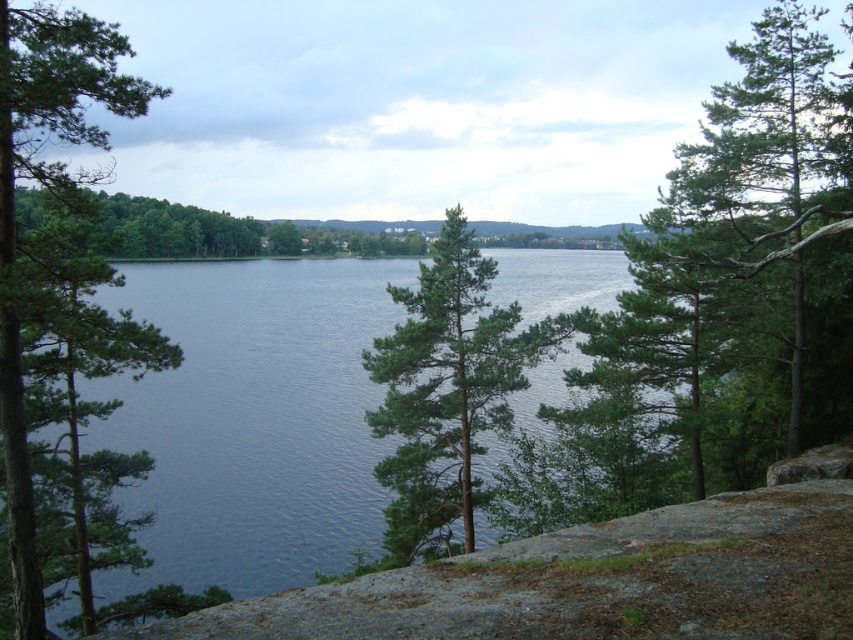
You are standing at the center of the image and want to locate the green textured tree at right. Which direction should you look to find it?

You should look to the right to find the green textured tree at right, as it is located at the right side of the image.

You are standing at the rocky edge of the cliff in the foreground. You see the blue water at center and the green matte tree at left. Which one is higher from the ground?

The blue water at center is higher than the green matte tree at left according to the description.